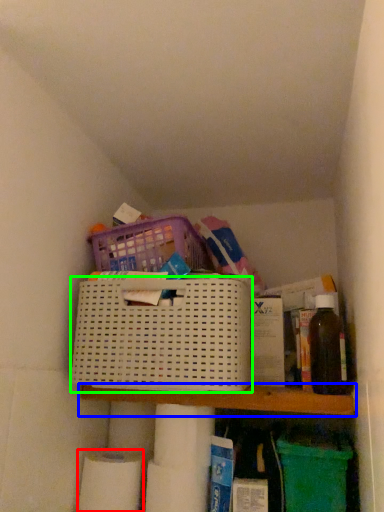
Question: Estimate the real-world distances between objects in this image. Which object is closer to toilet paper (highlighted by a red box), shelf (highlighted by a blue box) or basket (highlighted by a green box)?

Choices:
 (A) shelf
 (B) basket

Answer: (A)